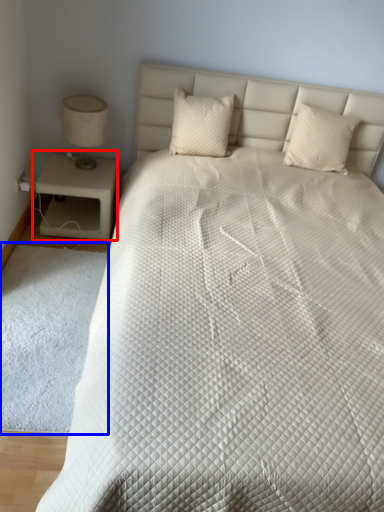
Question: Which object appears closest to the camera in this image, nightstand (highlighted by a red box) or mat (highlighted by a blue box)?

Choices:
 (A) nightstand
 (B) mat

Answer: (B)